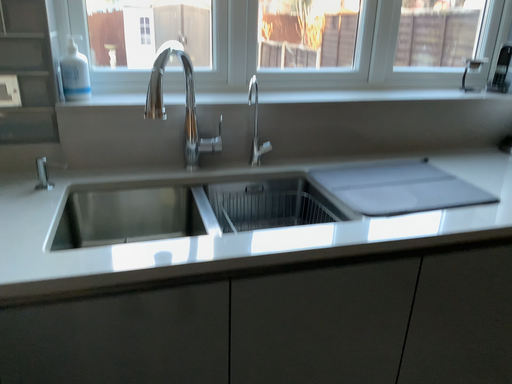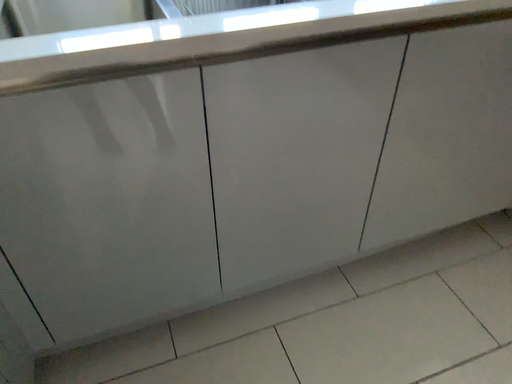
Question: How did the camera likely rotate when shooting the video?

Choices:
 (A) rotated upward
 (B) rotated downward

Answer: (B)